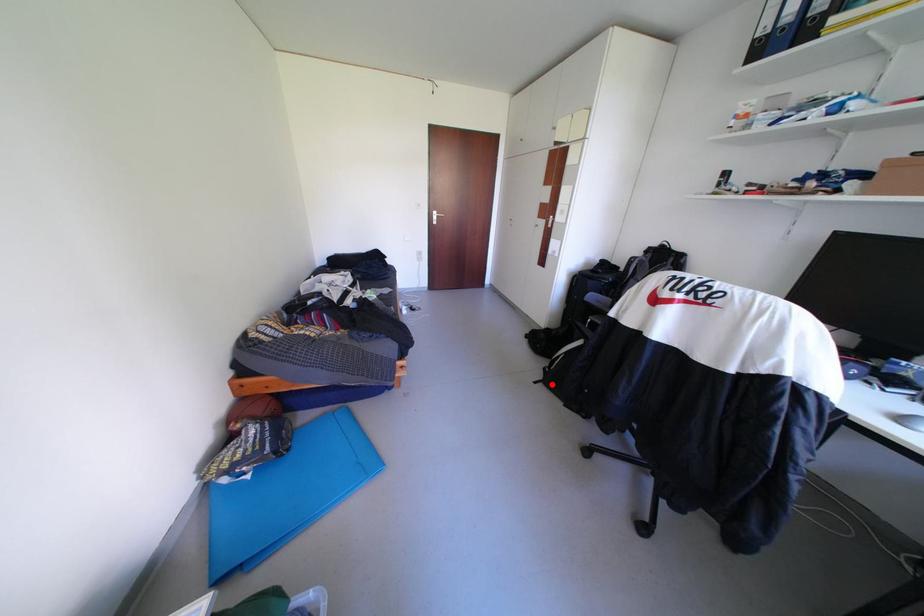
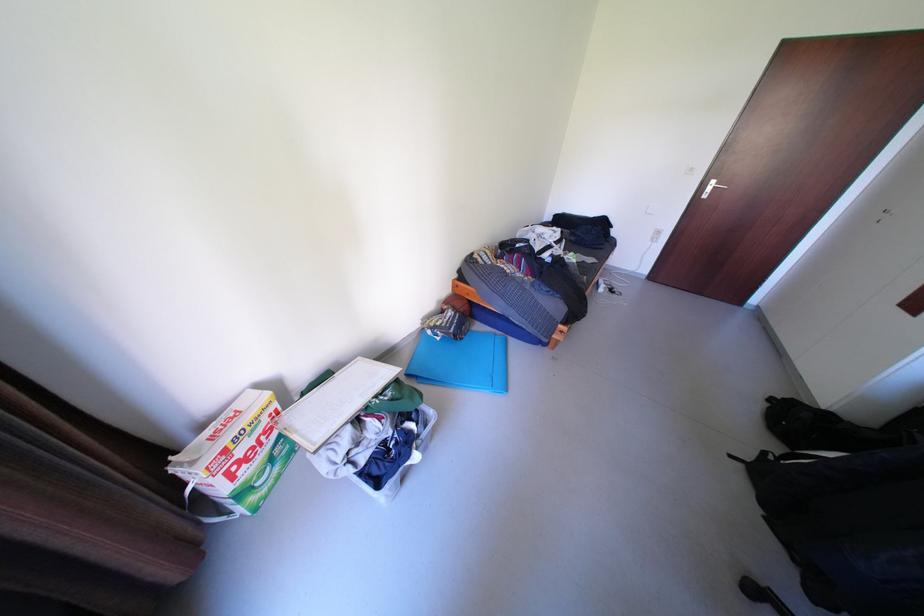
Question: I am providing you with two images of the same scene from different viewpoints. A red point is shown in image1. For the corresponding object point in image2, is it positioned nearer or farther from the camera?

Choices:
 (A) Nearer
 (B) Farther

Answer: (A)